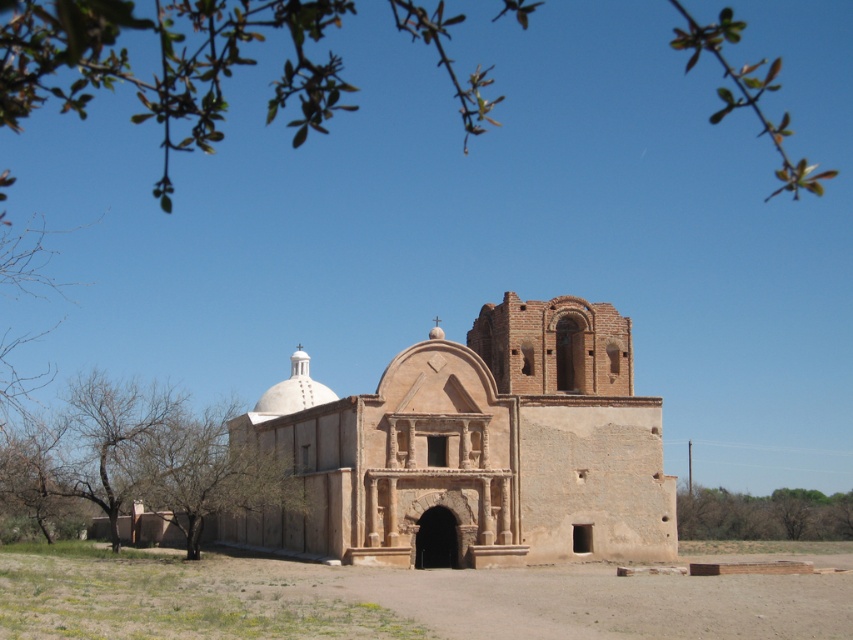
You are standing in front of the historic building and want to take a photo that includes both the brown stone church at center and the green leafy tree at lower left. Considering their sizes, which one should you focus on to ensure both fit in the frame?

The brown stone church at center is larger than the green leafy tree at lower left, so you should focus on the brown stone church at center to ensure both fit in the frame by positioning it centrally and framing the tree in the background or corner.

You are standing in front of the historic building and want to take a photo that includes both the brown stone church at center and the green leafy tree at lower right. Which object should you ensure is closer to the camera to include both in the frame?

The brown stone church at center is taller than the green leafy tree at lower right. To include both in the frame, you should ensure the brown stone church at center is closer to the camera since it is taller and might require more space vertically.

You are standing in front of the historic building described. You want to take a photo that includes both the brown stone church at center and the green leafy tree at lower left. Which one should you position closer to the bottom of your camera frame?

The green leafy tree at lower left should be positioned closer to the bottom of the camera frame because the brown stone church at center is above it, meaning the tree is lower in the scene.